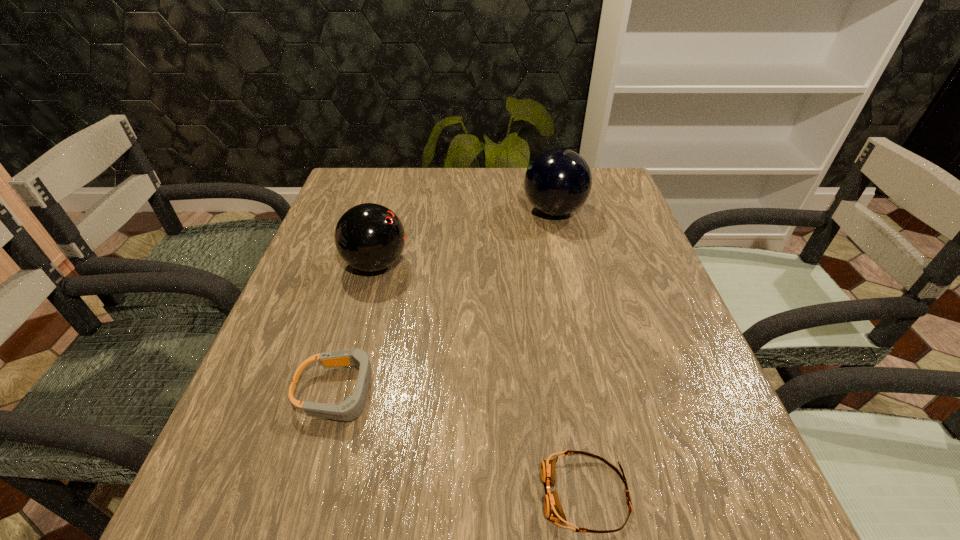
Find the location of a particular element. The height and width of the screenshot is (540, 960). the right bowling ball is located at coordinates (558, 181).

You are a GUI agent. You are given a task and a screenshot of the screen. Output one action in this format:
    pyautogui.click(x=<x>, y=<y>)
    Task: Click on the farthest object
    The width and height of the screenshot is (960, 540).
    Given the screenshot: What is the action you would take?
    pyautogui.click(x=558, y=181)

This screenshot has width=960, height=540. In order to click on the nearer bowling ball in this screenshot , I will do `click(370, 237)`.

I want to click on the left bowling ball, so click(x=370, y=237).

The height and width of the screenshot is (540, 960). In order to click on the third tallest object in this screenshot , I will do [350, 409].

Locate an element on the screen. This screenshot has height=540, width=960. the left goggles is located at coordinates (350, 409).

Where is `the nearer goggles`? The height and width of the screenshot is (540, 960). the nearer goggles is located at coordinates (553, 509).

Identify the location of the shorter goggles. (553, 509).

You are a GUI agent. You are given a task and a screenshot of the screen. Output one action in this format:
    pyautogui.click(x=<x>, y=<y>)
    Task: Click on the free space located on the side of the farther bowling ball with the finger holes
    Image resolution: width=960 pixels, height=540 pixels.
    Given the screenshot: What is the action you would take?
    pyautogui.click(x=392, y=211)

The width and height of the screenshot is (960, 540). I want to click on free space located on the side of the farther bowling ball with the finger holes, so click(477, 211).